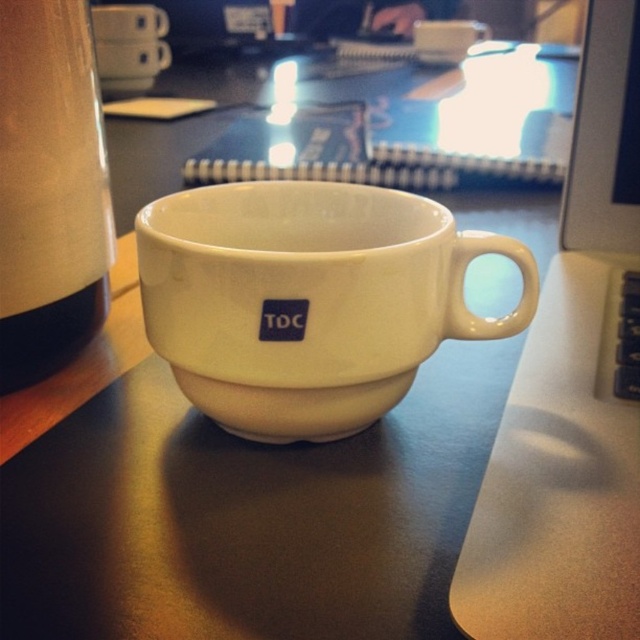
Which of these two, white ceramic mug at center or white matte mug at upper left, stands taller?

white ceramic mug at center

Which is above, white ceramic mug at center or white matte mug at upper left?

white matte mug at upper left is above.

The width and height of the screenshot is (640, 640). What do you see at coordinates (308, 300) in the screenshot? I see `white ceramic mug at center` at bounding box center [308, 300].

Identify the location of white ceramic mug at center. (308, 300).

Is point (163, 65) farther from camera compared to point (109, 24)?

That is True.

Is point (148, 76) in front of point (99, 17)?

No, (148, 76) is behind (99, 17).

Is point (147, 70) behind point (108, 33)?

That is True.

Locate an element on the screen. The height and width of the screenshot is (640, 640). white matte mug at upper center is located at coordinates (131, 58).

Is white ceramic mug at center to the left of white glossy laptop at right from the viewer's perspective?

Correct, you'll find white ceramic mug at center to the left of white glossy laptop at right.

Between point (429, 253) and point (579, 228), which one is positioned in front?

Point (429, 253) is more forward.

Identify the location of white ceramic mug at center. (308, 300).